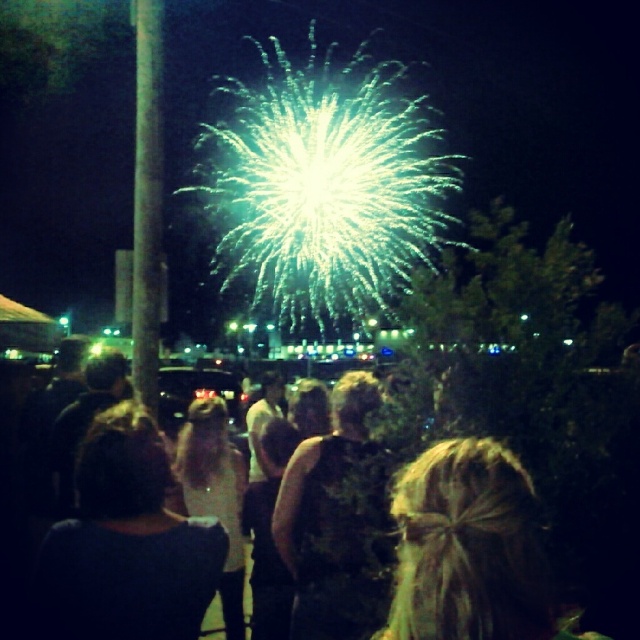
Does smooth metallic pole at left come behind black fabric crowd at center?

Yes, smooth metallic pole at left is further from the viewer.

Where is `smooth metallic pole at left`? smooth metallic pole at left is located at coordinates (147, 200).